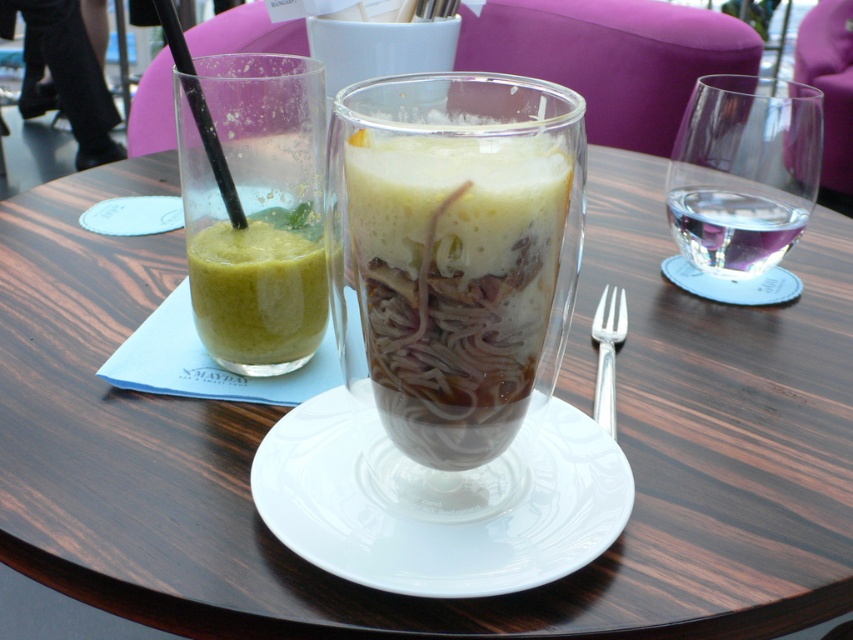
You are a customer at the cafe and want to choose the taller glass to drink your beverage. Which one should you pick between the translucent glass cup at center and the clear glass at upper right?

The clear glass at upper right is taller than the translucent glass cup at center, so you should choose the clear glass at upper right.

From the picture: You are a barista who needs to choose a glass for a new drink that requires a thicker glass to withstand high pressure. Which of the two glasses, the translucent glass cup at center or the clear glass at upper right, should you select?

The clear glass at upper right is thicker than the translucent glass cup at center, so you should select the clear glass at upper right for the new drink that requires a thicker glass to withstand high pressure.

You are a barista who needs to prepare a drink for a customer. You have a clear glass at upper right and a transparent plastic straw at upper center on the table. Which item can hold more liquid?

The clear glass at upper right can hold more liquid because it is bigger than the transparent plastic straw at upper center.